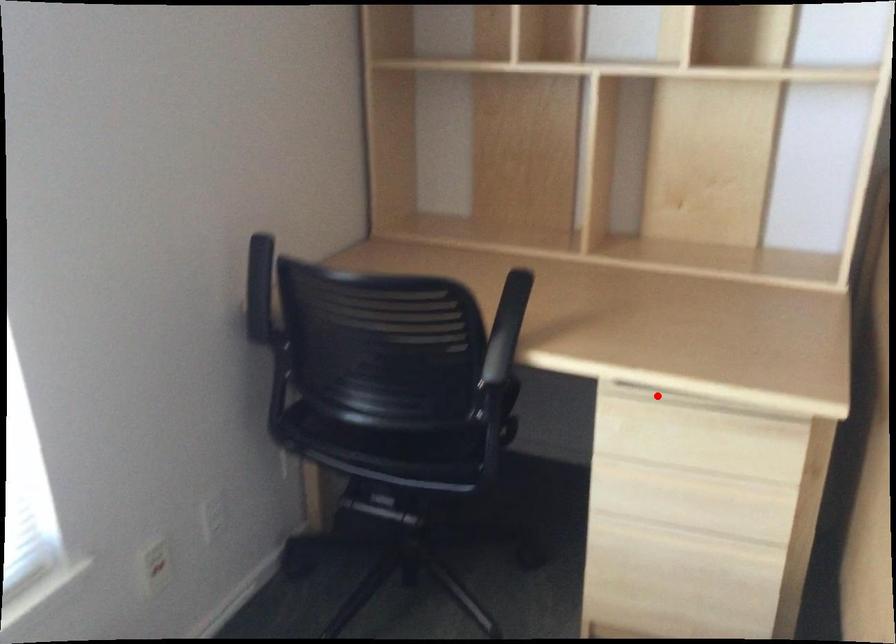
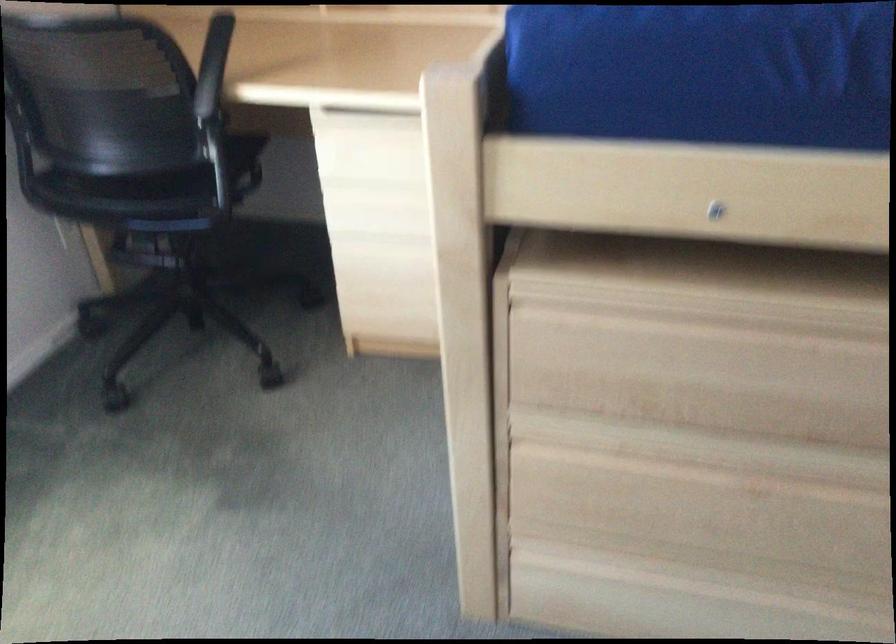
In the second image, find the point that corresponds to the highlighted location in the first image.

(364, 117)